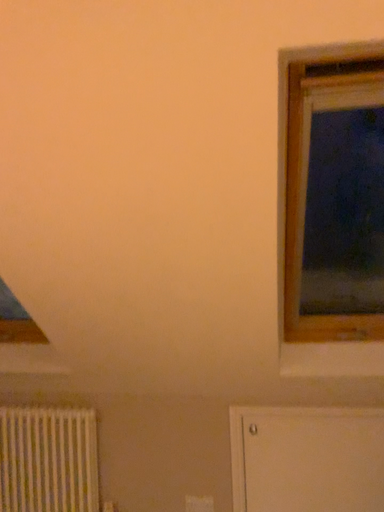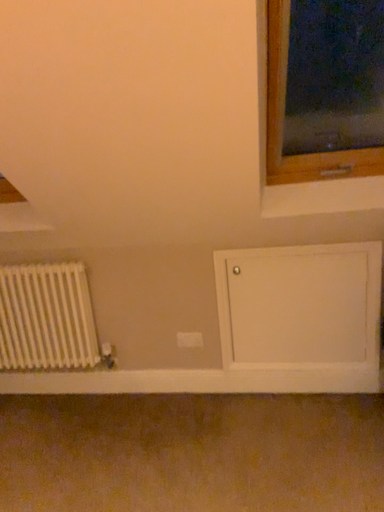
Question: How did the camera likely rotate when shooting the video?

Choices:
 (A) rotated downward
 (B) rotated upward

Answer: (A)